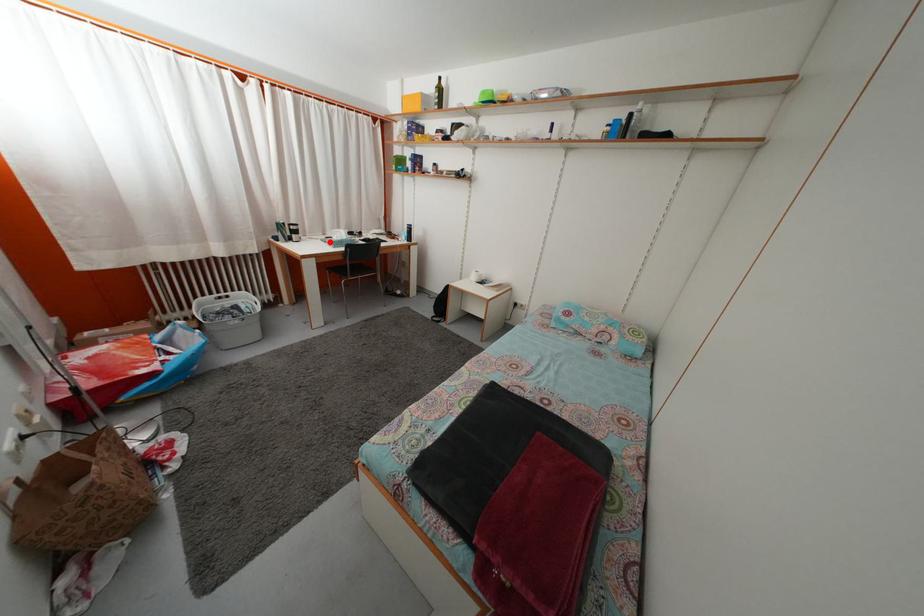
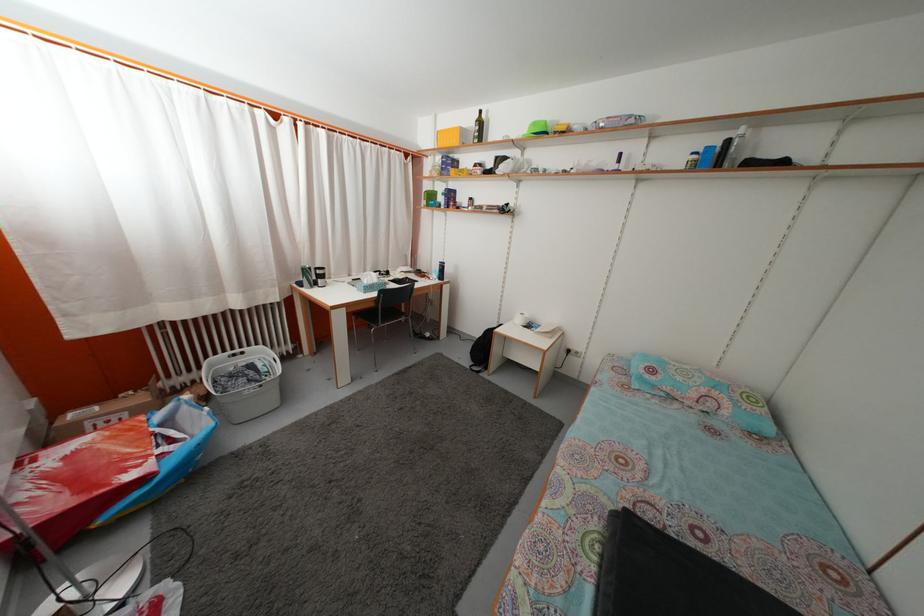
Question: I am providing you with two images of the same scene from different viewpoints. A red point is marked on the first image. Is the red point's position out of view in image 2?

Choices:
 (A) Yes
 (B) No

Answer: (B)